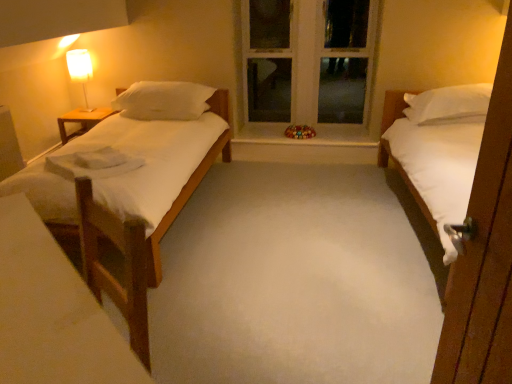
Question: Should I look upward or downward to see white soft pillow at left?

Choices:
 (A) down
 (B) up

Answer: (B)

Question: From a real-world perspective, is white wood window frame at center under wooden table at left?

Choices:
 (A) no
 (B) yes

Answer: (A)

Question: Is wooden table at left inside white wood window frame at center?

Choices:
 (A) yes
 (B) no

Answer: (B)

Question: Does white wood window frame at center have a larger size compared to wooden table at left?

Choices:
 (A) no
 (B) yes

Answer: (B)

Question: Can you confirm if white wood window frame at center is smaller than wooden table at left?

Choices:
 (A) no
 (B) yes

Answer: (A)

Question: Can you confirm if white wood window frame at center is taller than wooden table at left?

Choices:
 (A) yes
 (B) no

Answer: (A)

Question: Could you tell me if white wood window frame at center is turned towards wooden table at left?

Choices:
 (A) yes
 (B) no

Answer: (B)

Question: Is smooth glass window sill at center looking in the opposite direction of white wood window frame at center?

Choices:
 (A) yes
 (B) no

Answer: (A)

Question: Can you confirm if smooth glass window sill at center is wider than white wood window frame at center?

Choices:
 (A) no
 (B) yes

Answer: (B)

Question: Does smooth glass window sill at center have a smaller size compared to white wood window frame at center?

Choices:
 (A) yes
 (B) no

Answer: (A)

Question: Does smooth glass window sill at center come behind white wood window frame at center?

Choices:
 (A) yes
 (B) no

Answer: (A)

Question: From the image's perspective, is smooth glass window sill at center below white wood window frame at center?

Choices:
 (A) yes
 (B) no

Answer: (A)

Question: From a real-world perspective, is smooth glass window sill at center physically above white wood window frame at center?

Choices:
 (A) yes
 (B) no

Answer: (B)

Question: From a real-world perspective, is white matte bed at right physically above white soft pillow at left?

Choices:
 (A) yes
 (B) no

Answer: (B)